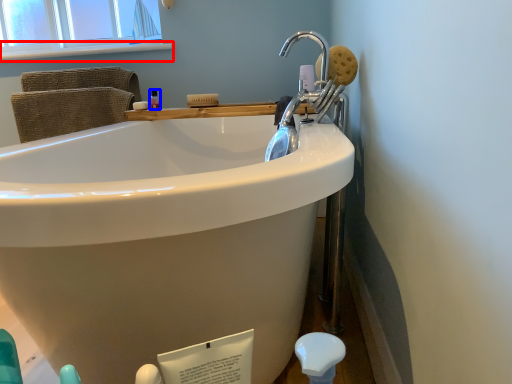
Question: Which of the following is the farthest to the observer, window sill (highlighted by a red box) or mouthwash (highlighted by a blue box)?

Choices:
 (A) window sill
 (B) mouthwash

Answer: (A)